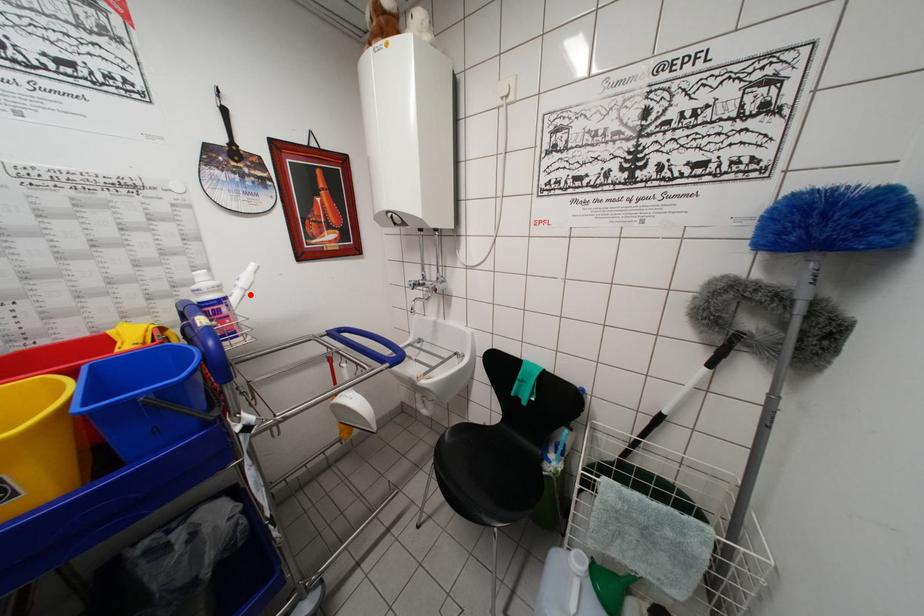
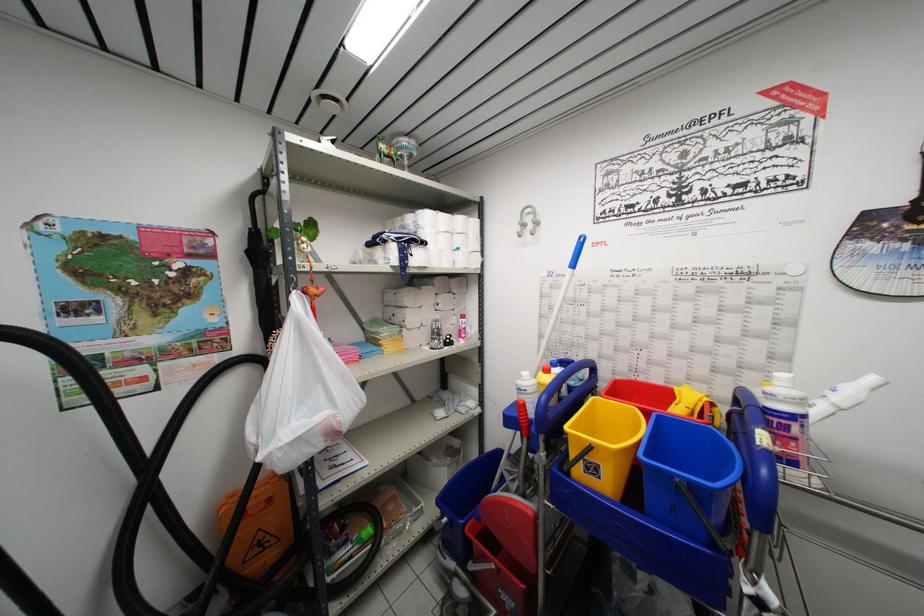
In the second image, find the point that corresponds to the highlighted location in the first image.

(845, 415)